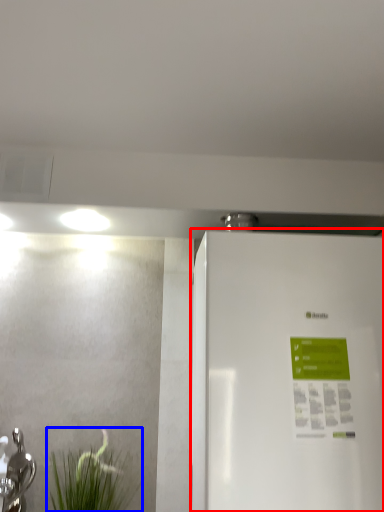
Question: Which object is further to the camera taking this photo, refrigerator (highlighted by a red box) or plant (highlighted by a blue box)?

Choices:
 (A) refrigerator
 (B) plant

Answer: (B)